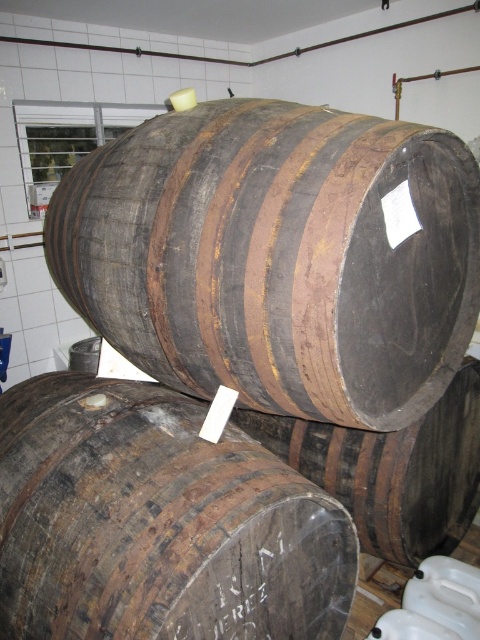
You are navigating through the storage area and need to reach a specific location marked by point coordinates. You are currently at point coordinates point (135,132). Which direction should you move to get closer to the other point point (464,476)?

Since point (135,132) is in front of point (464,476), you should move backward to get closer to point (464,476).

You are a warehouse worker tasked with stacking more barrels. You have a new barrel that is exactly the same size as the dark brown wood barrel at center. Can you safely place it on top of the rusty wood barrel at center without exceeding the weight limit?

The rusty wood barrel at center is larger in size than dark brown wood barrel at center. Since the new barrel is the same size as the dark brown one, it should fit on top of the rusty barrel. However, the weight capacity isn

You are a worker in the storage area and need to move the dark brown wooden barrel at center and the dark brown wood barrel at center. Which one should you move first if you want to reach the one behind them?

You should move the dark brown wood barrel at center first because the dark brown wooden barrel at center is to the left of it, meaning the dark brown wood barrel at center is on the right side and closer to the back. Moving it first would allow access to the one behind both.